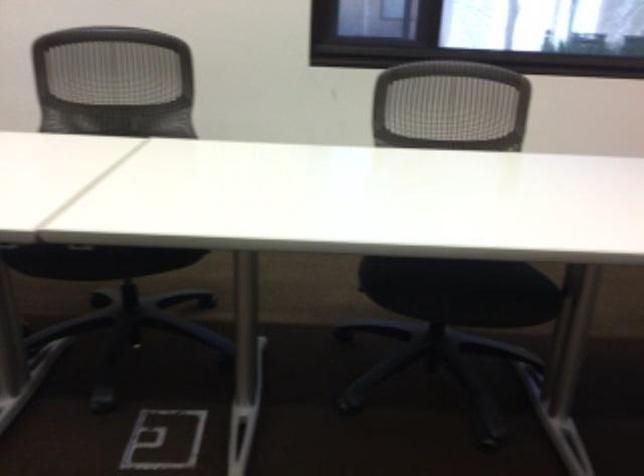
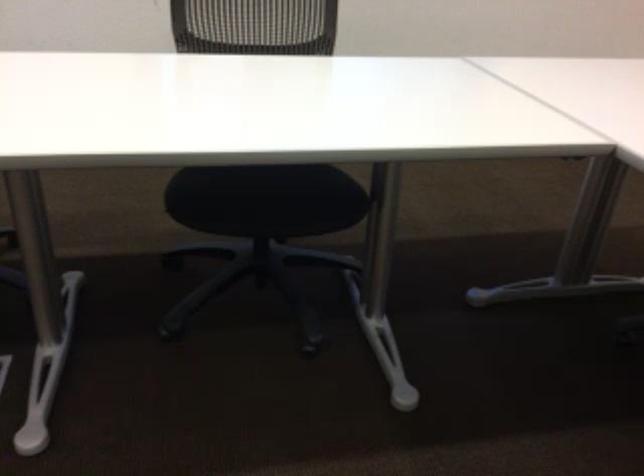
The point at (x=451, y=290) is marked in the first image. Where is the corresponding point in the second image?

(266, 199)